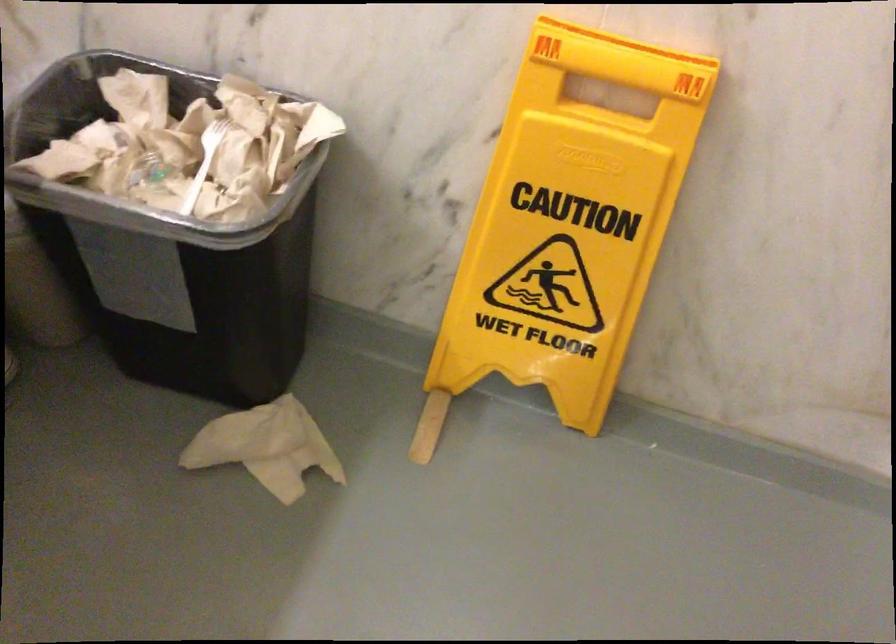
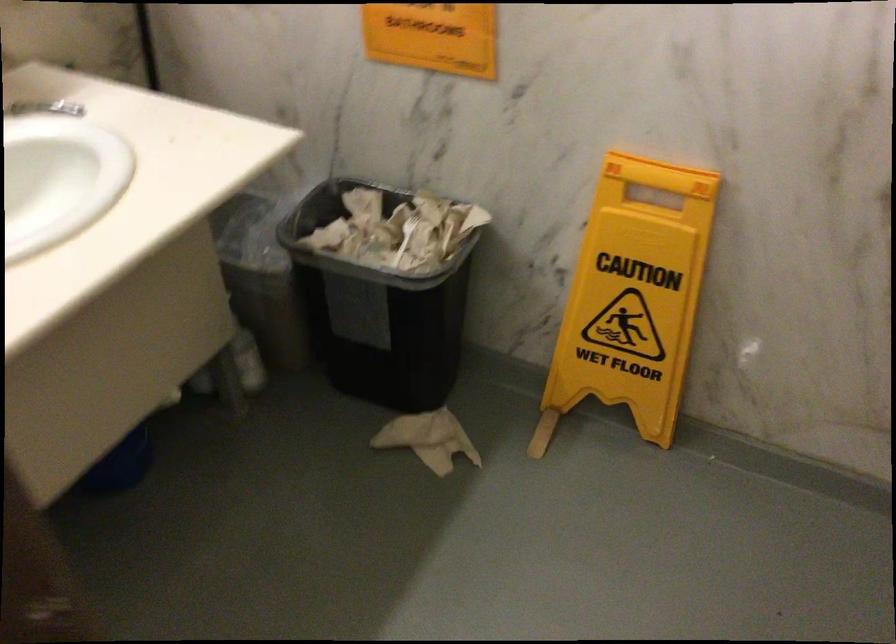
Where in the second image is the point corresponding to point (268, 442) from the first image?

(428, 439)